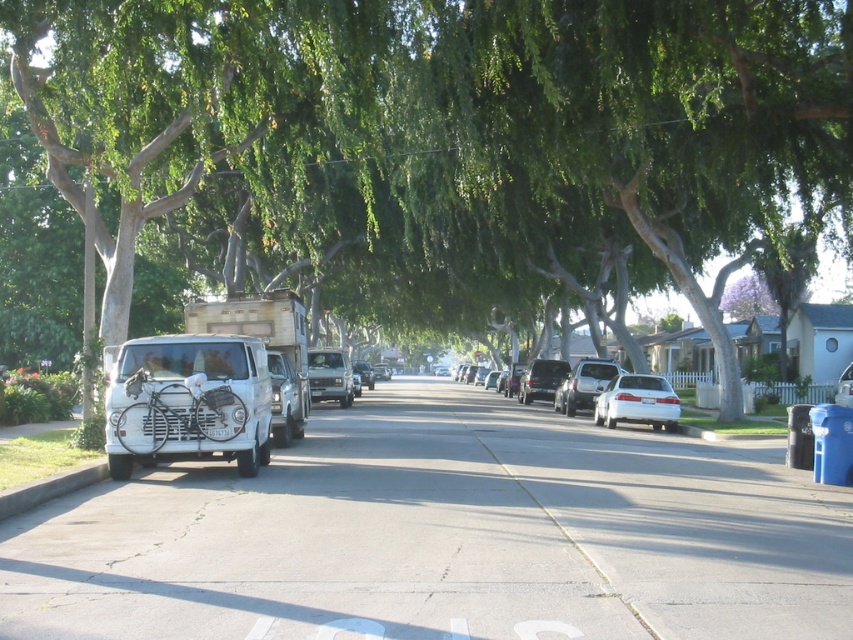
Which is more to the right, white matte sedan at center or white glossy sedan at center-right?

Positioned to the right is white glossy sedan at center-right.

In the scene shown: Does white matte sedan at center have a lesser width compared to white glossy sedan at center-right?

Incorrect, white matte sedan at center's width is not less than white glossy sedan at center-right's.

Is point (582, 365) positioned behind point (656, 429)?

Yes, point (582, 365) is farther from viewer.

Image resolution: width=853 pixels, height=640 pixels. I want to click on white matte sedan at center, so click(x=618, y=396).

Looking at this image, is white matte van at center thinner than silver metallic sedan at center?

No.

Is white matte van at center to the left of silver metallic sedan at center from the viewer's perspective?

Incorrect, white matte van at center is not on the left side of silver metallic sedan at center.

The width and height of the screenshot is (853, 640). I want to click on white matte van at center, so click(x=187, y=403).

Between silver metallic jeep at center and metallic silver jeep at center, which one is positioned lower?

metallic silver jeep at center is lower down.

Is silver metallic jeep at center bigger than metallic silver jeep at center?

No.

Does point (328, 355) lie behind point (509, 365)?

That is False.

At what (x,y) coordinates should I click in order to perform the action: click on silver metallic jeep at center. Please return your answer as a coordinate pair (x, y). The width and height of the screenshot is (853, 640). Looking at the image, I should click on (329, 376).